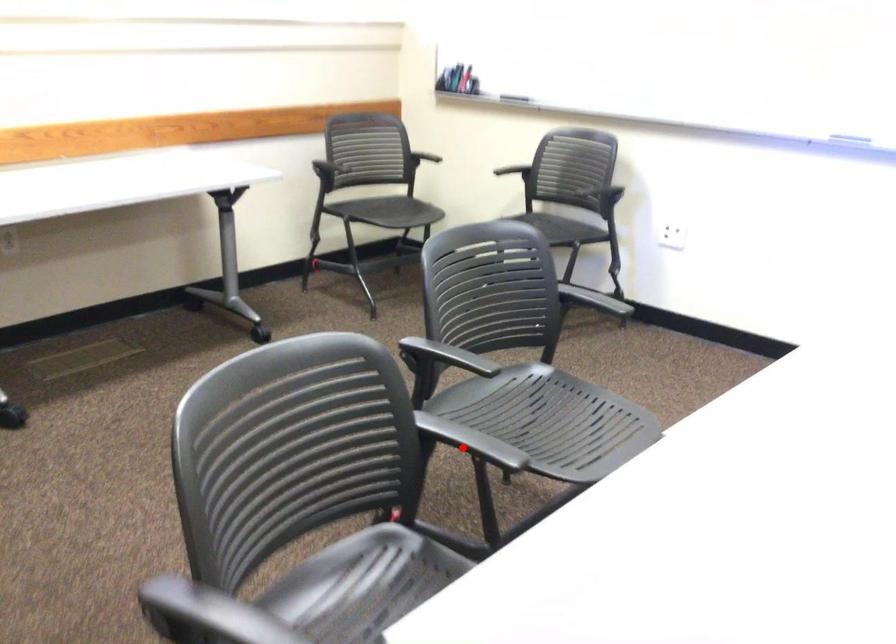
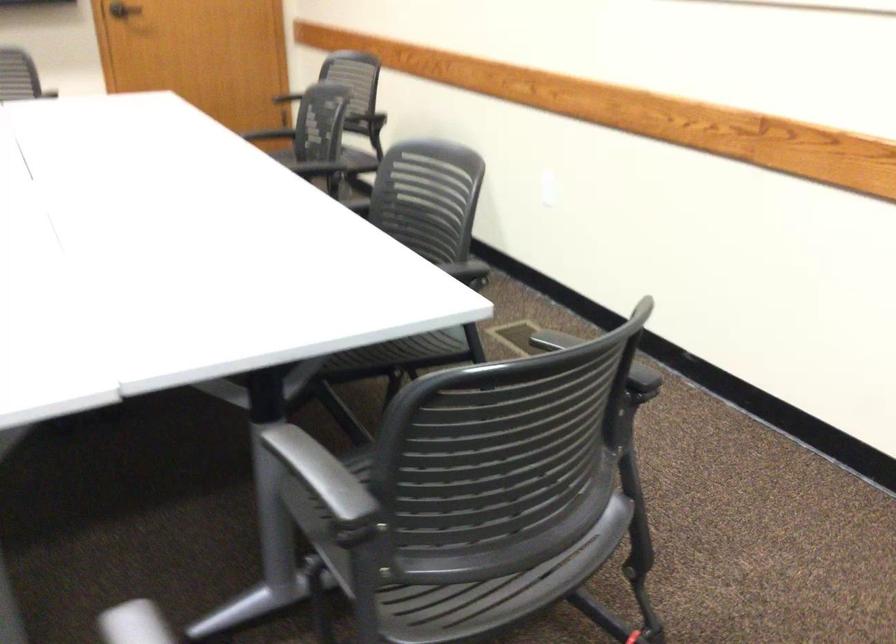
Question: I am providing you with two images of the same scene from different viewpoints. A red point is shown in image1. For the corresponding object point in image2, is it positioned nearer or farther from the camera?

Choices:
 (A) Nearer
 (B) Farther

Answer: (A)